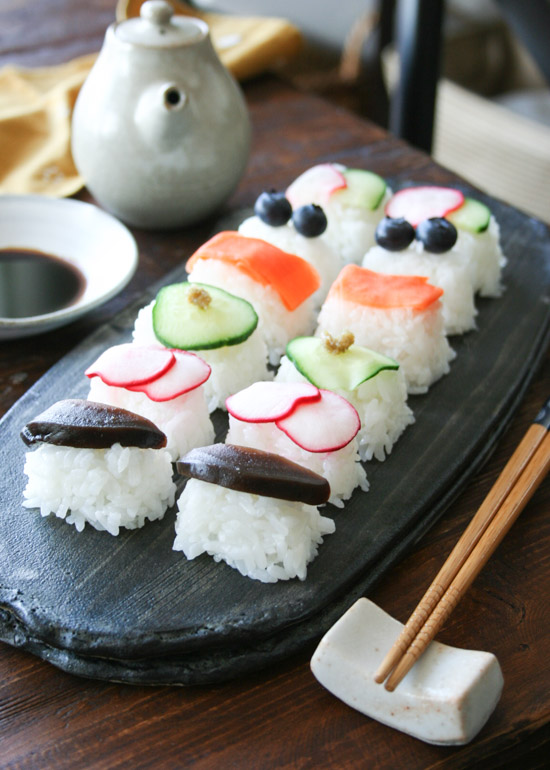
Locate an element on the screen. ceramic chopsticks holder is located at coordinates (433, 671).